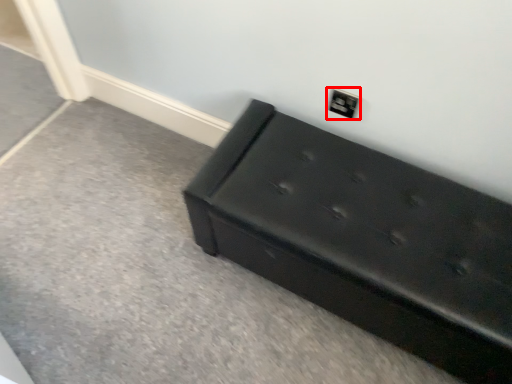
Question: In this image, where is electric outlet (annotated by the red box) located relative to furniture?

Choices:
 (A) left
 (B) right

Answer: (A)